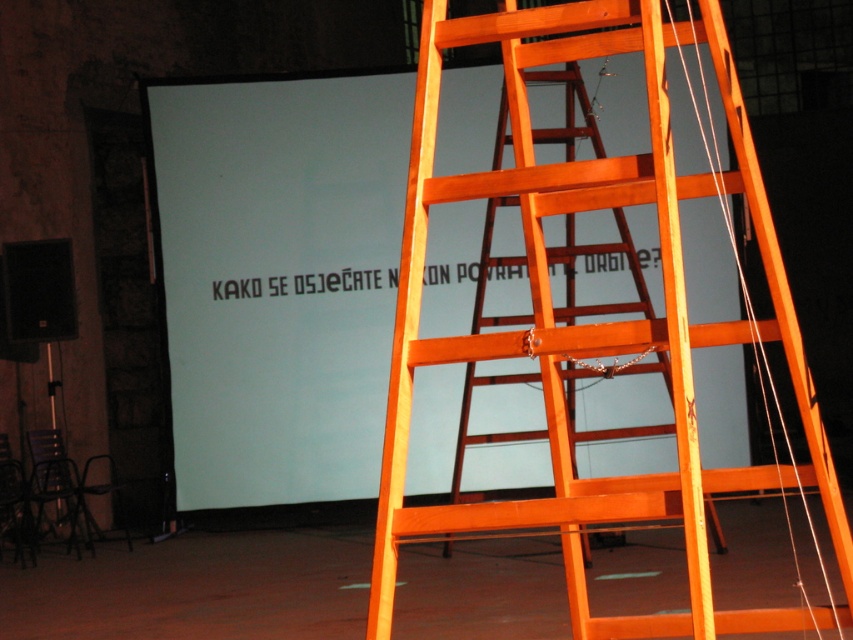
Question: Which point appears closest to the camera in this image?

Choices:
 (A) (248, 272)
 (B) (486, 244)

Answer: (B)

Question: Which point is farther to the camera?

Choices:
 (A) white matte projection screen at upper left
 (B) orange wooden ladder at center
 (C) orange wood ladder at center

Answer: (A)

Question: Among these objects, which one is farthest from the camera?

Choices:
 (A) orange wooden ladder at center
 (B) orange wood ladder at center

Answer: (A)

Question: Can you confirm if orange wood ladder at center is positioned to the left of orange wooden ladder at center?

Choices:
 (A) yes
 (B) no

Answer: (A)

Question: Is white matte projection screen at upper left thinner than orange wooden ladder at center?

Choices:
 (A) no
 (B) yes

Answer: (A)

Question: Does orange wood ladder at center appear on the left side of orange wooden ladder at center?

Choices:
 (A) yes
 (B) no

Answer: (A)